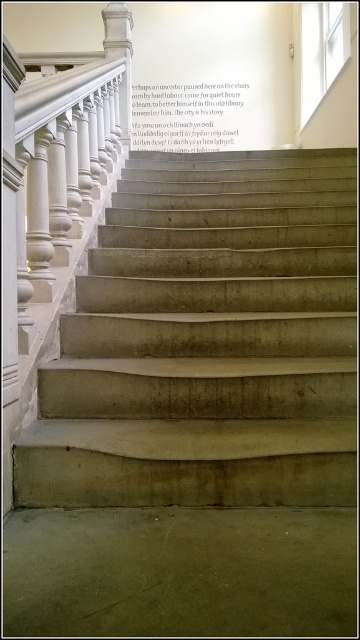
Question: Does concrete stairs at center come in front of white marble pillar at upper center?

Choices:
 (A) no
 (B) yes

Answer: (B)

Question: Which of the following is the farthest from the observer?

Choices:
 (A) brown concrete floor at lower center
 (B) white marble pillar at upper center

Answer: (B)

Question: Among these points, which one is nearest to the camera?

Choices:
 (A) (123, 44)
 (B) (210, 564)
 (C) (69, 394)

Answer: (B)

Question: Which point is closer to the camera?

Choices:
 (A) white marble pillar at upper center
 (B) brown concrete floor at lower center

Answer: (B)

Question: Does concrete stairs at center appear under white marble pillar at upper center?

Choices:
 (A) no
 (B) yes

Answer: (B)

Question: Is concrete stairs at center smaller than white marble pillar at upper center?

Choices:
 (A) no
 (B) yes

Answer: (A)